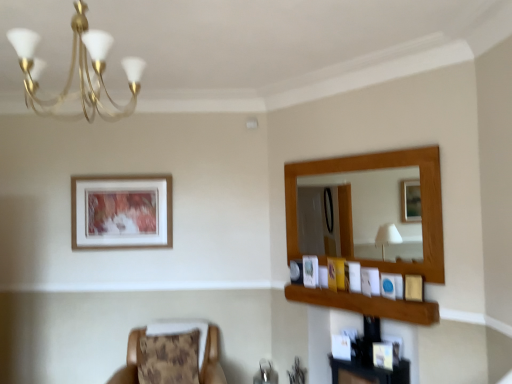
Question: From the image's perspective, is wooden picture frame at upper right, positioned as the fourth picture frame in right-to-left order, located above wooden framed artwork at upper left, positioned as the 1th picture frame in back-to-front order?

Choices:
 (A) yes
 (B) no

Answer: (B)

Question: Can you confirm if wooden picture frame at upper right, placed as the 4th picture frame when sorted from front to back, is smaller than wooden framed artwork at upper left, which appears as the 6th picture frame when viewed from the right?

Choices:
 (A) yes
 (B) no

Answer: (A)

Question: Is wooden picture frame at upper right, placed as the 4th picture frame when sorted from front to back, looking in the opposite direction of wooden framed artwork at upper left, acting as the first picture frame starting from the left?

Choices:
 (A) yes
 (B) no

Answer: (B)

Question: Is wooden picture frame at upper right, the 3th picture frame when ordered from back to front, thinner than wooden framed artwork at upper left, positioned as the 1th picture frame in back-to-front order?

Choices:
 (A) no
 (B) yes

Answer: (A)

Question: From a real-world perspective, does wooden picture frame at upper right, the 3th picture frame when ordered from back to front, sit lower than wooden framed artwork at upper left, acting as the first picture frame starting from the left?

Choices:
 (A) no
 (B) yes

Answer: (B)

Question: From a real-world perspective, is wooden picture frame at upper right, the 3th picture frame when ordered from back to front, over wooden framed artwork at upper left, acting as the first picture frame starting from the left?

Choices:
 (A) yes
 (B) no

Answer: (B)

Question: Does brown textured cushion at lower left have a smaller size compared to matte blue picture frame at upper right, the fifth picture frame positioned from the back?

Choices:
 (A) no
 (B) yes

Answer: (A)

Question: From the image's perspective, does brown textured cushion at lower left appear higher than matte blue picture frame at upper right, the 2th picture frame from the front?

Choices:
 (A) no
 (B) yes

Answer: (A)

Question: Is brown textured cushion at lower left turned away from matte blue picture frame at upper right, the fifth picture frame positioned from the back?

Choices:
 (A) no
 (B) yes

Answer: (A)

Question: Does brown textured cushion at lower left have a larger size compared to matte blue picture frame at upper right, arranged as the second picture frame when viewed from the right?

Choices:
 (A) yes
 (B) no

Answer: (A)

Question: Is brown textured cushion at lower left taller than matte blue picture frame at upper right, the 2th picture frame from the front?

Choices:
 (A) yes
 (B) no

Answer: (A)

Question: Is brown textured cushion at lower left to the right of matte blue picture frame at upper right, the 2th picture frame from the front, from the viewer's perspective?

Choices:
 (A) yes
 (B) no

Answer: (B)

Question: Is wooden picture frame at upper right, the 3th picture frame when ordered from back to front, wider than brown textured cushion at lower left?

Choices:
 (A) yes
 (B) no

Answer: (B)